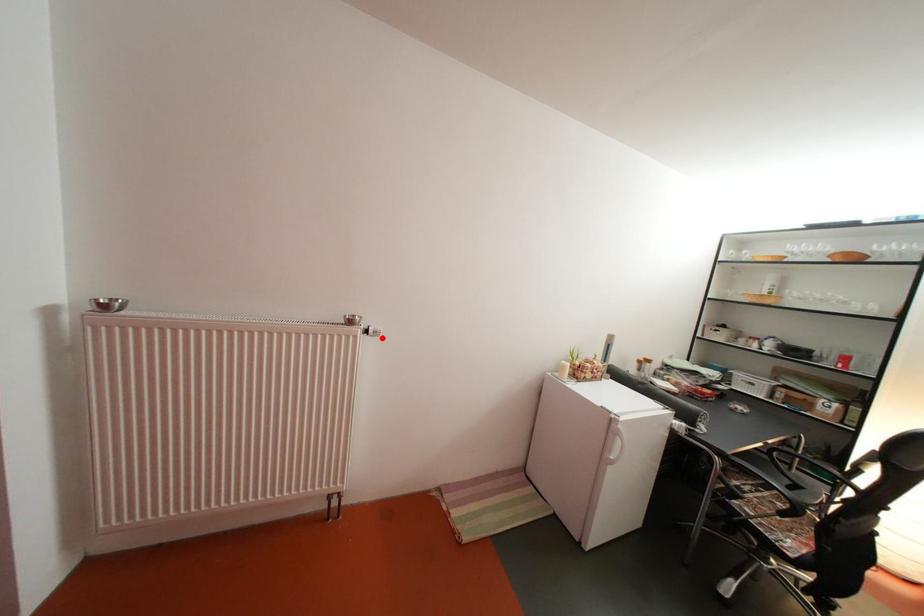
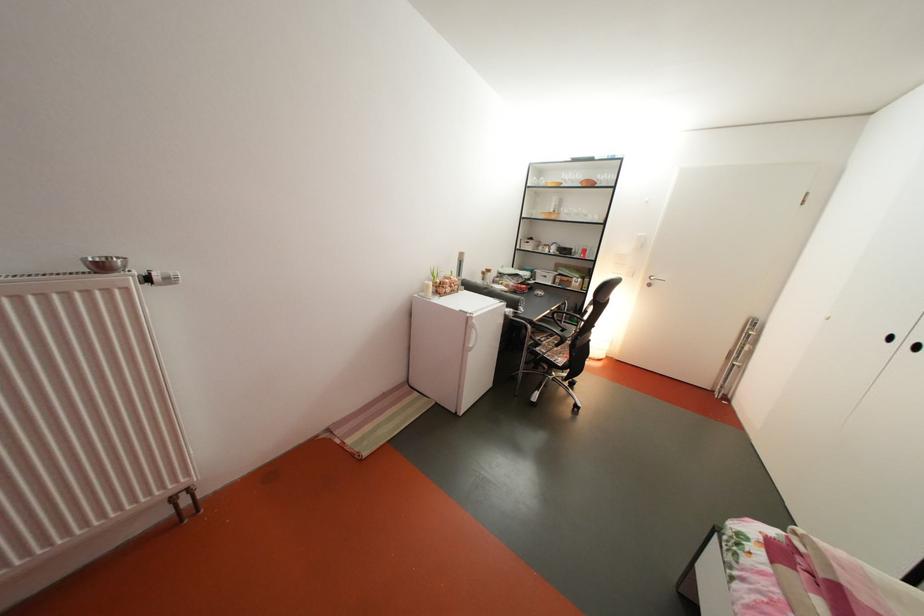
Find the pixel in the second image that matches the highlighted location in the first image.

(168, 285)